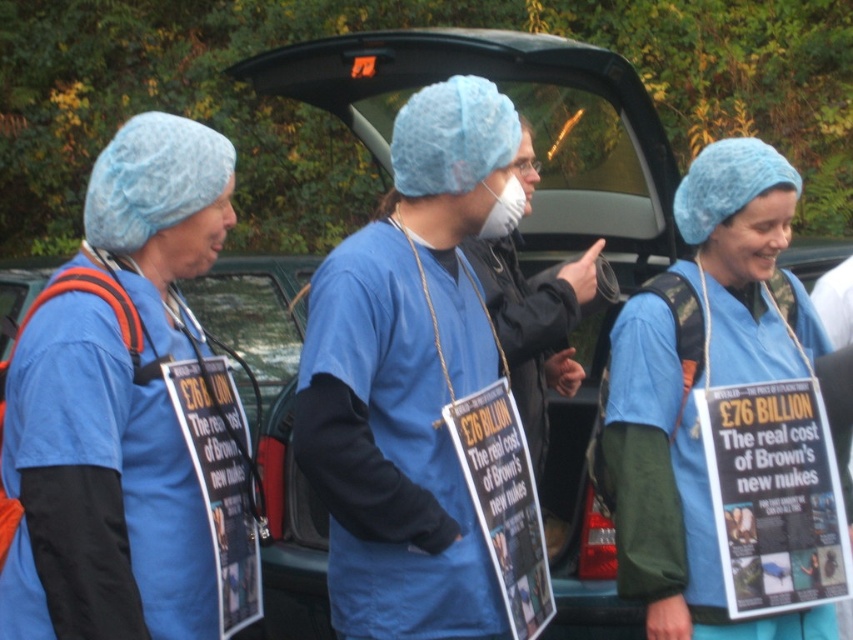
Question: Is matte blue hairnet at left to the left of matte blue hairnet at center from the viewer's perspective?

Choices:
 (A) yes
 (B) no

Answer: (A)

Question: Is the position of matte blue hairnet at left less distant than that of matte blue hairnet at center?

Choices:
 (A) yes
 (B) no

Answer: (A)

Question: Is matte blue hairnet at left further to camera compared to matte blue hairnet at center?

Choices:
 (A) yes
 (B) no

Answer: (B)

Question: Which point is closer to the camera?

Choices:
 (A) matte blue hairnet at left
 (B) matte blue hairnet at center

Answer: (A)